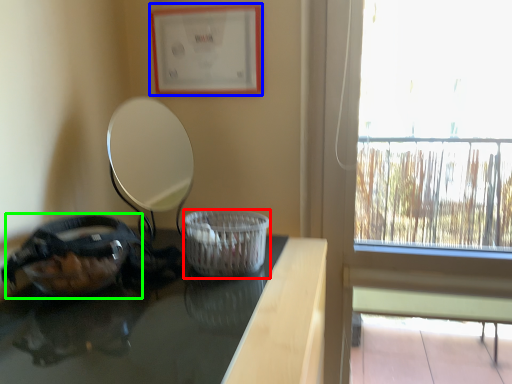
Question: Considering the real-world distances, which object is closest to basket container (highlighted by a red box)? picture frame (highlighted by a blue box) or glass bowl (highlighted by a green box).

Choices:
 (A) picture frame
 (B) glass bowl

Answer: (B)